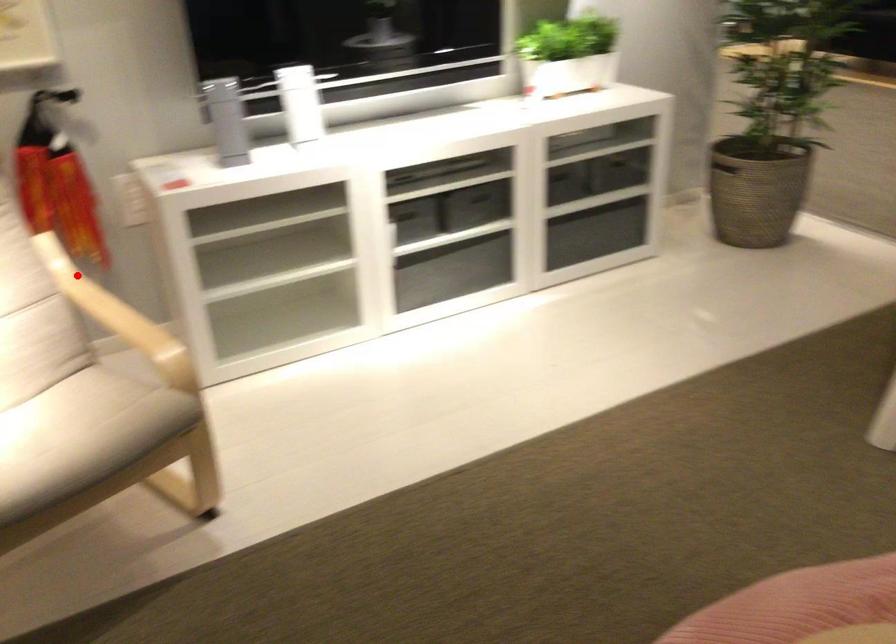
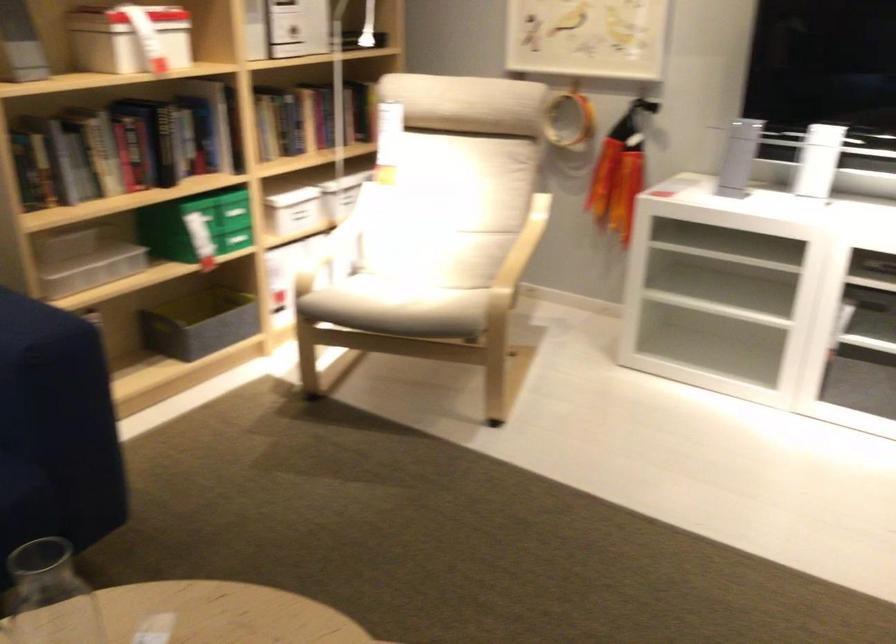
Question: A red point is marked in image1. In image2, is the corresponding 3D point closer to the camera or farther? Reply with the corresponding letter.

Choices:
 (A) The corresponding 3D point is closer.
 (B) The corresponding 3D point is farther.

Answer: (B)